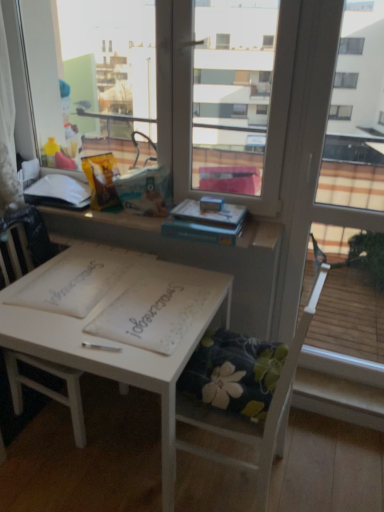
Locate an element on the screen. The height and width of the screenshot is (512, 384). vacant area situated to the left side of white paper notebook at center, which appears as the second notebook when viewed from the left is located at coordinates 77,302.